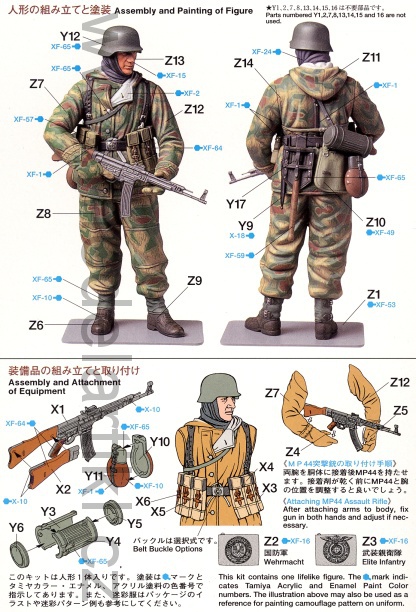
Locate an element on the screen. This screenshot has height=612, width=416. paint of figure is located at coordinates (197, 10).